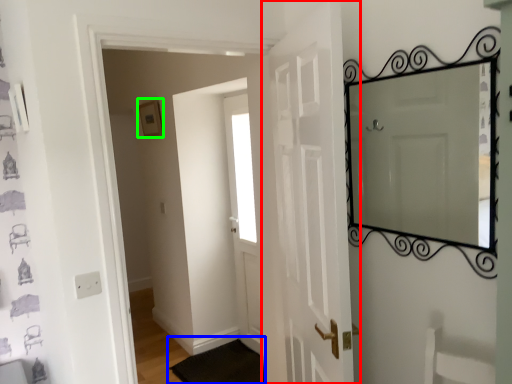
Question: Considering the real-world distances, which object is closest to door (highlighted by a red box)? doormat (highlighted by a blue box) or picture frame (highlighted by a green box).

Choices:
 (A) doormat
 (B) picture frame

Answer: (A)